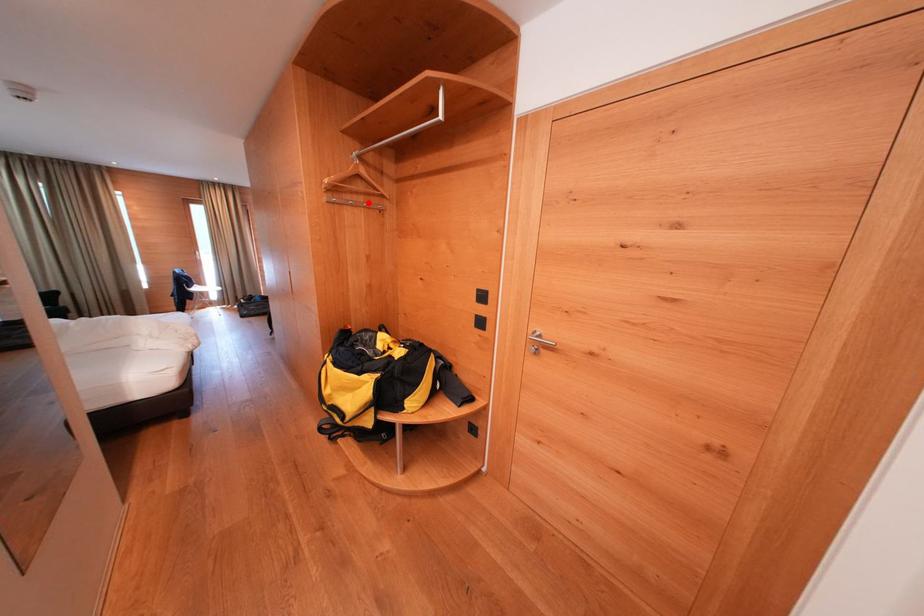
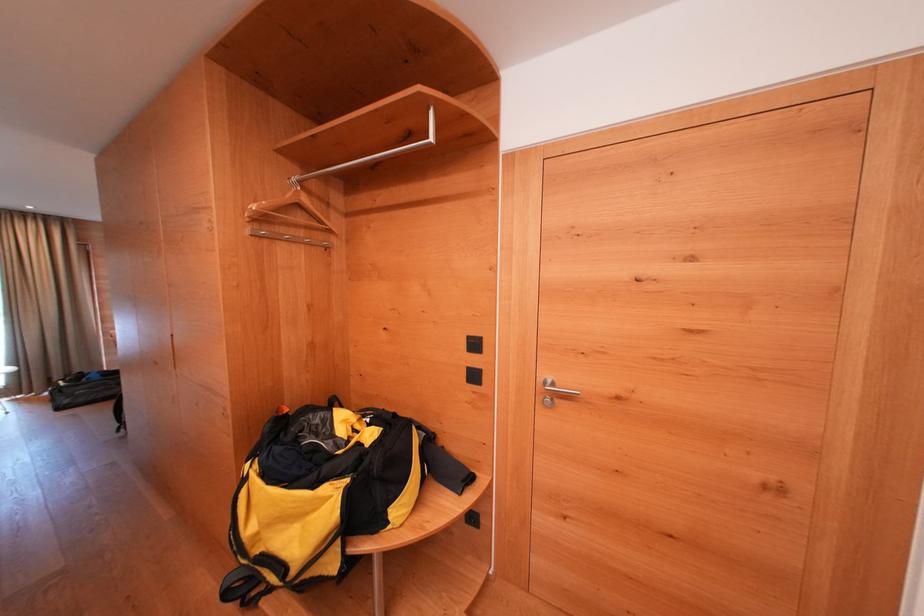
Find the pixel in the second image that matches the highlighted location in the first image.

(308, 237)